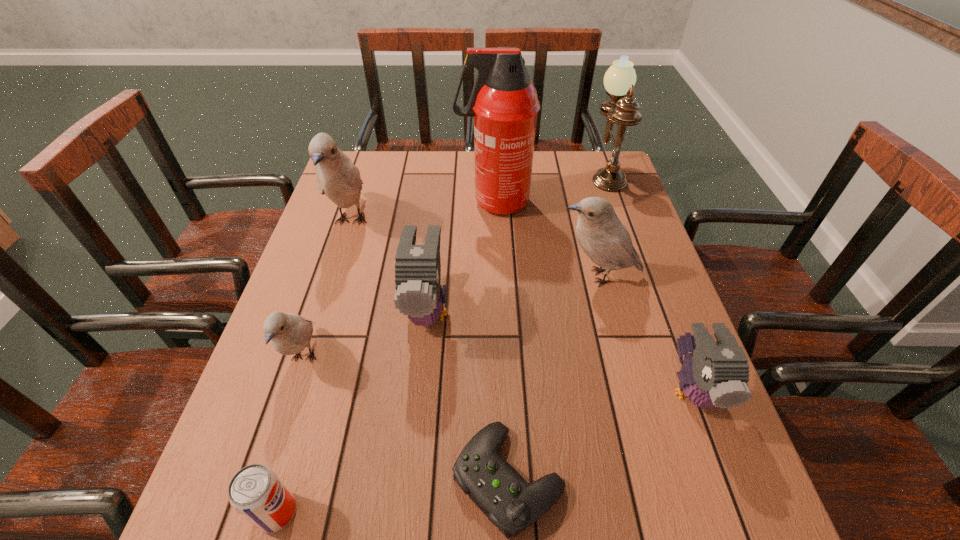
The width and height of the screenshot is (960, 540). Find the location of `the right gray bird`. the right gray bird is located at coordinates (716, 374).

Where is `soda`? The image size is (960, 540). soda is located at coordinates (256, 492).

Find the location of a particular element. The image size is (960, 540). blank space located 0.050m on the trigger side of the fire extinguisher is located at coordinates (441, 202).

At what (x,y) coordinates should I click in order to perform the action: click on blank space located 0.260m on the trigger side of the fire extinguisher. Please return your answer as a coordinate pair (x, y). Looking at the image, I should click on (371, 202).

Where is `vacant region located on the trigger side of the fire extinguisher`? vacant region located on the trigger side of the fire extinguisher is located at coordinates (404, 202).

Identify the location of free space located 0.330m on the left of the oil lamp. This screenshot has height=540, width=960. point(489,172).

Find the location of a particular element. The width and height of the screenshot is (960, 540). vacant area situated 0.320m at the beak of the farthest white bird is located at coordinates [x=308, y=355].

The width and height of the screenshot is (960, 540). What are the coordinates of `free space located at the beak of the second smallest white bird` in the screenshot? It's located at (420, 276).

Where is `vacant space located 0.080m at the beak of the second smallest white bird`? Image resolution: width=960 pixels, height=540 pixels. vacant space located 0.080m at the beak of the second smallest white bird is located at coordinates (524, 276).

Locate an element on the screen. The image size is (960, 540). vacant position located 0.230m at the beak of the second smallest white bird is located at coordinates (464, 276).